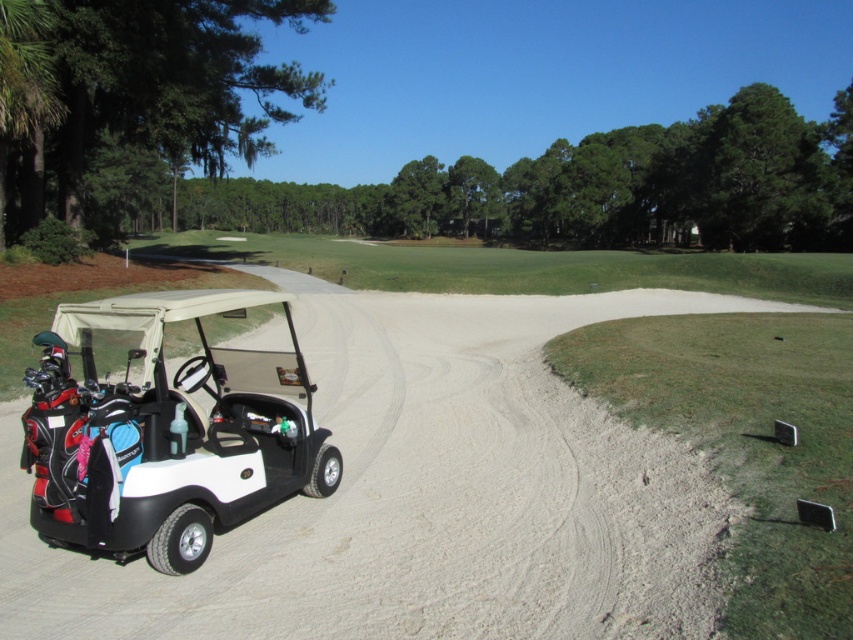
Question: Is white matte golf cart at lower left below white matte golf cart at left?

Choices:
 (A) no
 (B) yes

Answer: (A)

Question: Among these points, which one is nearest to the camera?

Choices:
 (A) (33, 488)
 (B) (405, 355)

Answer: (A)

Question: Can you confirm if white matte golf cart at lower left is wider than white matte golf cart at left?

Choices:
 (A) yes
 (B) no

Answer: (A)

Question: Does white matte golf cart at lower left lie in front of white matte golf cart at left?

Choices:
 (A) no
 (B) yes

Answer: (B)

Question: Which point is farther to the camera?

Choices:
 (A) white matte golf cart at left
 (B) white matte golf cart at lower left

Answer: (A)